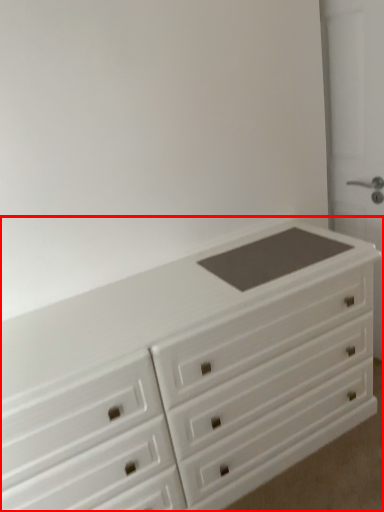
Question: Observing the image, what is the correct spatial positioning of chest of drawers (annotated by the red box) in reference to screen door?

Choices:
 (A) left
 (B) right

Answer: (A)